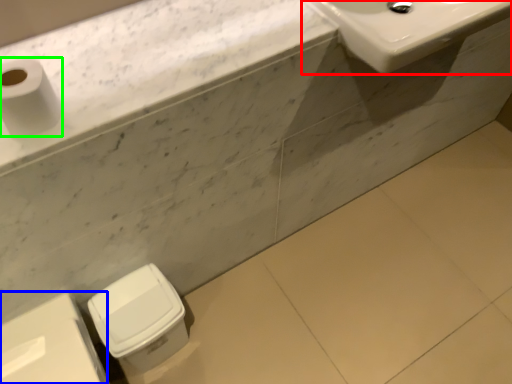
Question: Considering the real-world distances, which object is farthest from sink (highlighted by a red box)? porcelain (highlighted by a blue box) or toilet paper (highlighted by a green box)?

Choices:
 (A) porcelain
 (B) toilet paper

Answer: (A)